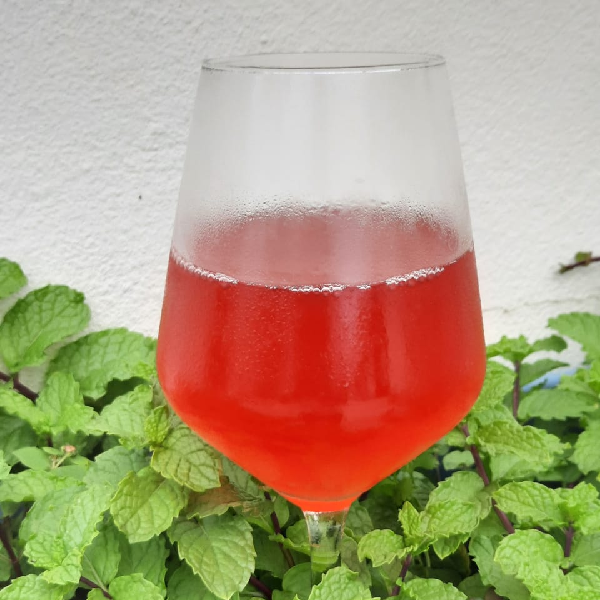
This screenshot has height=600, width=600. Identify the location of white wall. (527, 200).